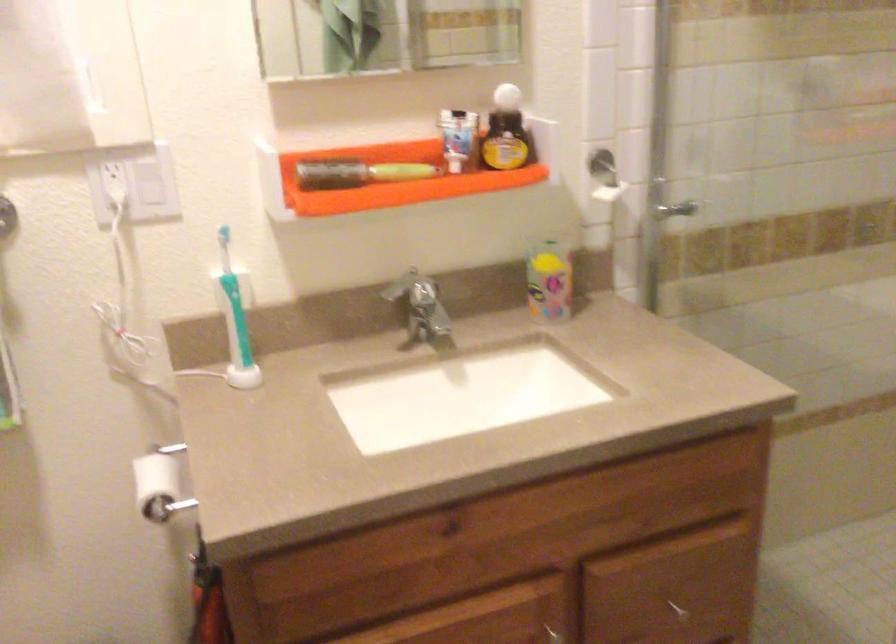
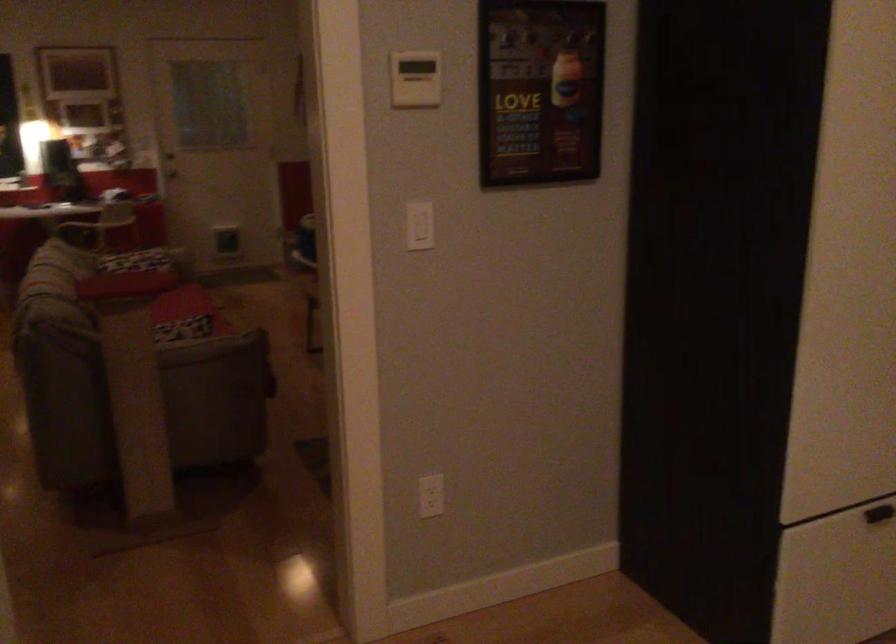
Question: How did the camera likely rotate?

Choices:
 (A) Left
 (B) Right
 (C) Up
 (D) Down

Answer: (B)